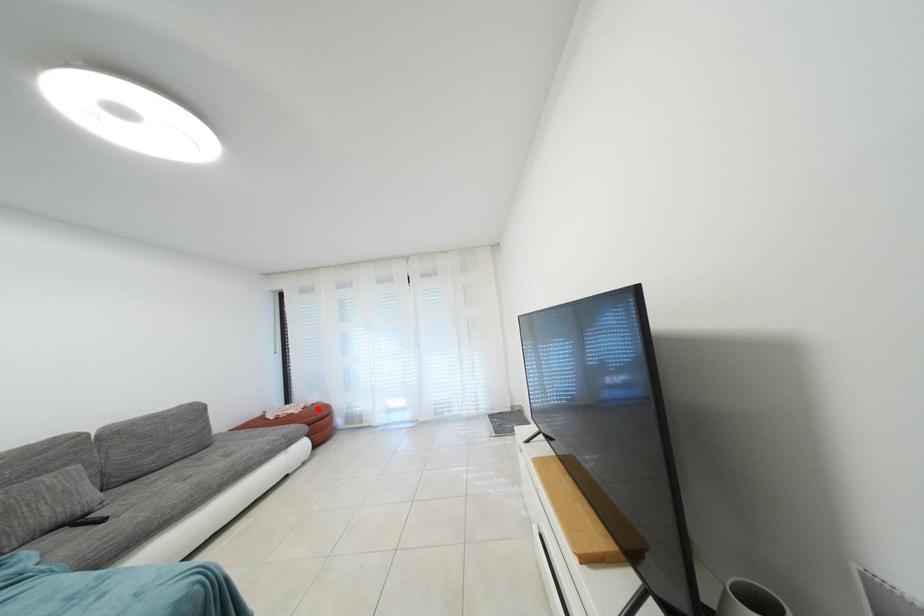
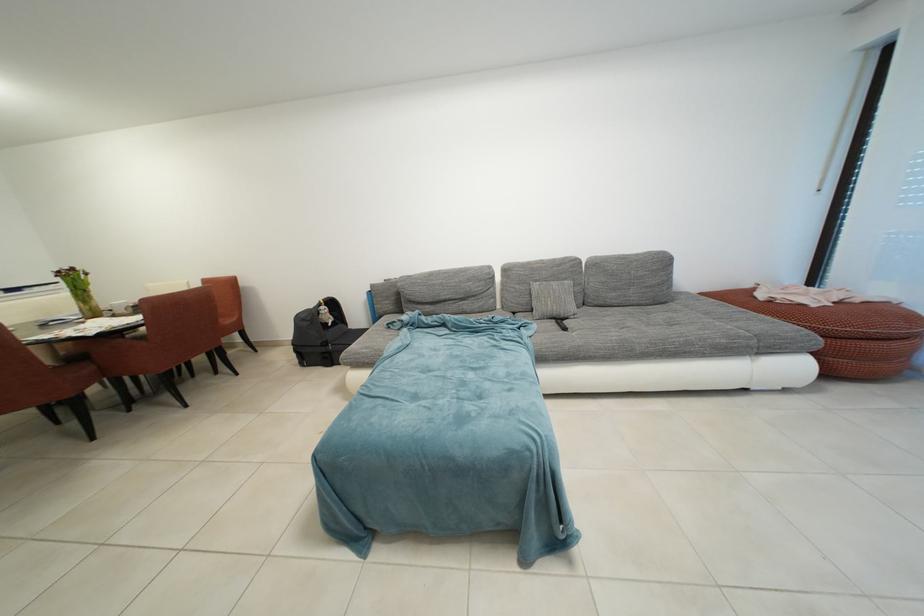
Locate, in the second image, the point that corresponds to the highlighted location in the first image.

(865, 305)